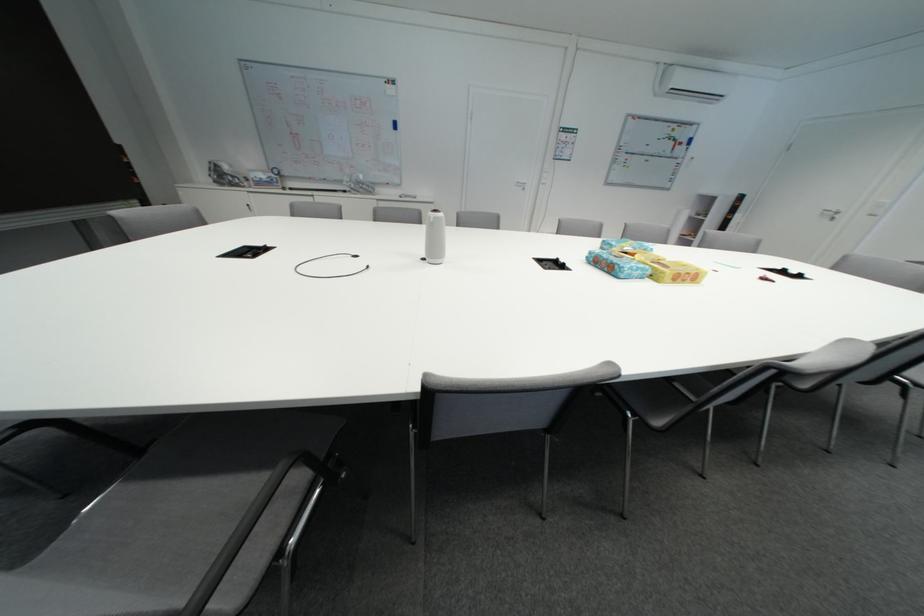
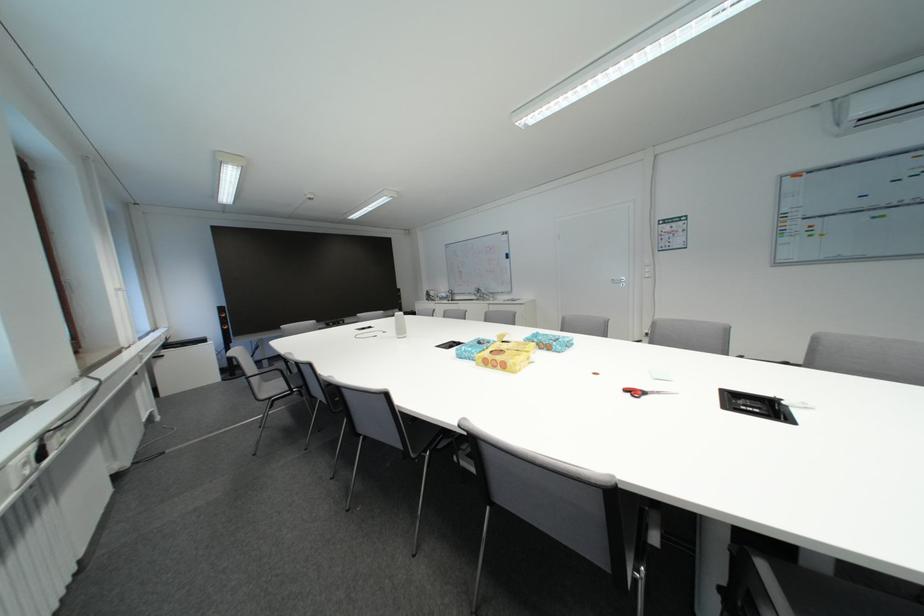
Locate, in the second image, the point that corresponds to point 648,272 in the first image.

(476, 354)